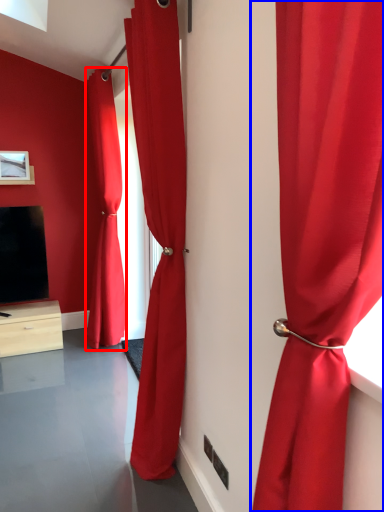
Question: Which point is closer to the camera, curtain (highlighted by a red box) or curtain (highlighted by a blue box)?

Choices:
 (A) curtain
 (B) curtain

Answer: (B)